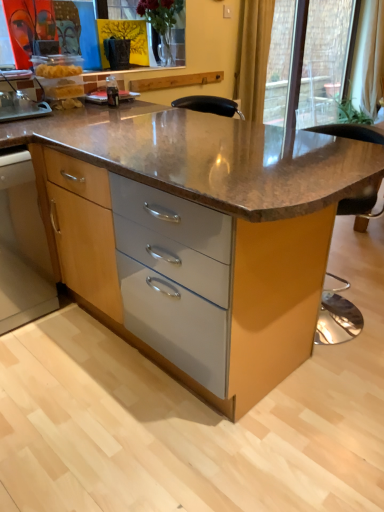
Question: Is transparent glass door at upper right positioned in front of yellow fabric curtain at upper right?

Choices:
 (A) no
 (B) yes

Answer: (A)

Question: Considering the relative sizes of transparent glass door at upper right and yellow fabric curtain at upper right in the image provided, is transparent glass door at upper right bigger than yellow fabric curtain at upper right?

Choices:
 (A) yes
 (B) no

Answer: (A)

Question: From a real-world perspective, is transparent glass door at upper right over yellow fabric curtain at upper right?

Choices:
 (A) yes
 (B) no

Answer: (B)

Question: Is transparent glass door at upper right turned away from yellow fabric curtain at upper right?

Choices:
 (A) yes
 (B) no

Answer: (B)

Question: Can you confirm if transparent glass door at upper right is smaller than yellow fabric curtain at upper right?

Choices:
 (A) yes
 (B) no

Answer: (B)

Question: Is yellow fabric curtain at upper right completely or partially inside transparent glass door at upper right?

Choices:
 (A) yes
 (B) no

Answer: (B)

Question: Is wooden cabinet at lower left outside brown polished granite table at center?

Choices:
 (A) yes
 (B) no

Answer: (A)

Question: Is wooden cabinet at lower left to the right of brown polished granite table at center from the viewer's perspective?

Choices:
 (A) no
 (B) yes

Answer: (A)

Question: Does wooden cabinet at lower left lie behind brown polished granite table at center?

Choices:
 (A) yes
 (B) no

Answer: (A)

Question: From a real-world perspective, is wooden cabinet at lower left on brown polished granite table at center?

Choices:
 (A) yes
 (B) no

Answer: (B)

Question: Does wooden cabinet at lower left have a greater width compared to brown polished granite table at center?

Choices:
 (A) yes
 (B) no

Answer: (B)

Question: Would you say wooden cabinet at lower left contains brown polished granite table at center?

Choices:
 (A) yes
 (B) no

Answer: (B)

Question: Can you confirm if brown polished granite table at center is thinner than yellow fabric curtain at upper right?

Choices:
 (A) yes
 (B) no

Answer: (B)